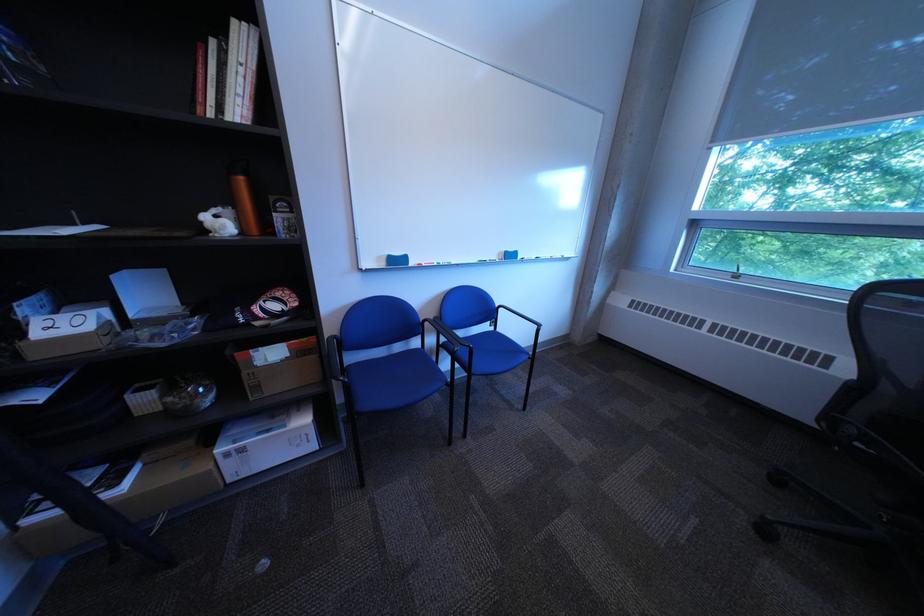
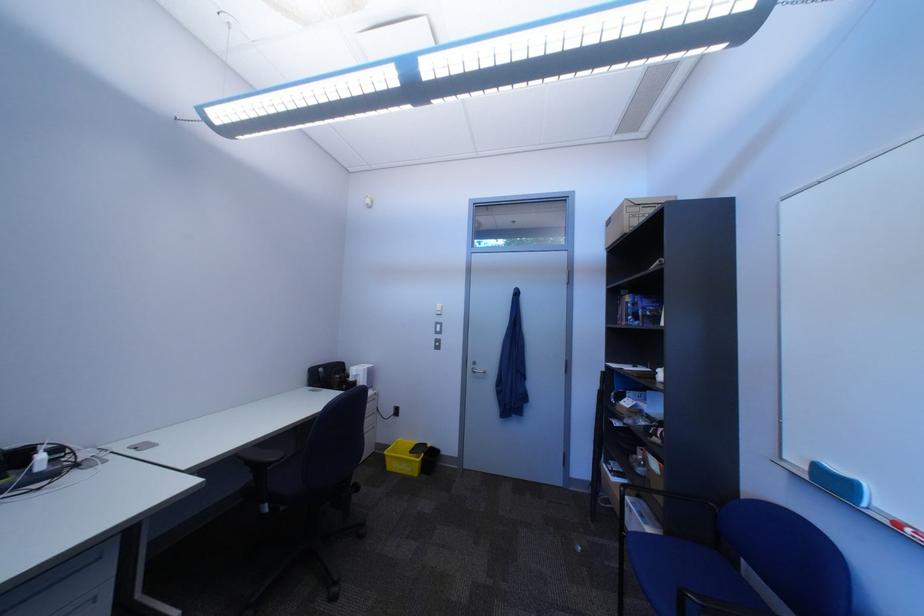
Locate, in the second image, the point that corresponds to [436,265] in the first image.

(915, 527)